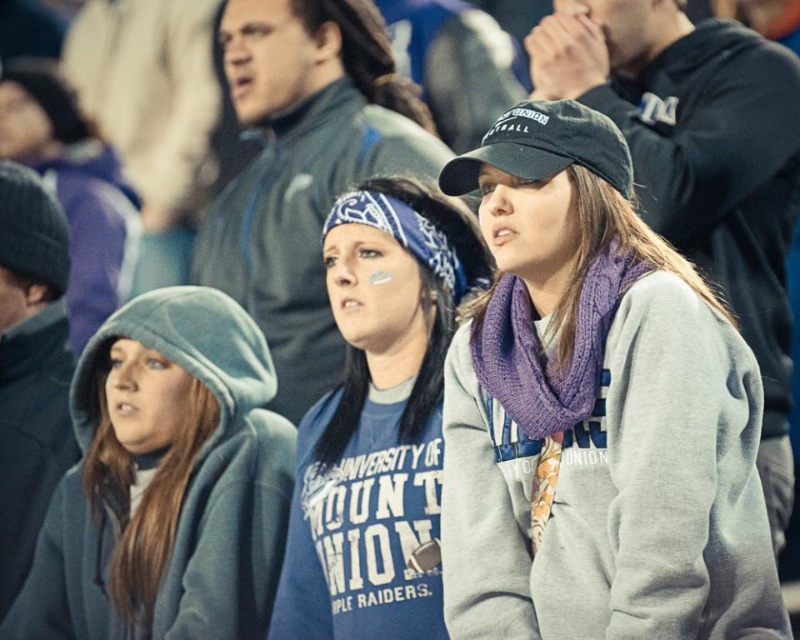
Between light blue fleece hoodie at lower left and blue fabric shirt at center, which one appears on the right side from the viewer's perspective?

blue fabric shirt at center is more to the right.

Can you confirm if light blue fleece hoodie at lower left is bigger than blue fabric shirt at center?

Indeed, light blue fleece hoodie at lower left has a larger size compared to blue fabric shirt at center.

Locate an element on the screen. light blue fleece hoodie at lower left is located at coordinates (165, 483).

Image resolution: width=800 pixels, height=640 pixels. Find the location of `light blue fleece hoodie at lower left`. light blue fleece hoodie at lower left is located at coordinates (165, 483).

Which is in front, point (520, 384) or point (404, 611)?

Positioned in front is point (520, 384).

At what (x,y) coordinates should I click in order to perform the action: click on purple knit scarf at center. Please return your answer as a coordinate pair (x, y). Looking at the image, I should click on (596, 412).

Is purple knit scarf at center below light blue fleece hoodie at lower left?

Actually, purple knit scarf at center is above light blue fleece hoodie at lower left.

Between purple knit scarf at center and light blue fleece hoodie at lower left, which one is positioned higher?

purple knit scarf at center is above.

Is point (466, 172) positioned behind point (124, 310)?

No.

The width and height of the screenshot is (800, 640). Identify the location of purple knit scarf at center. (596, 412).